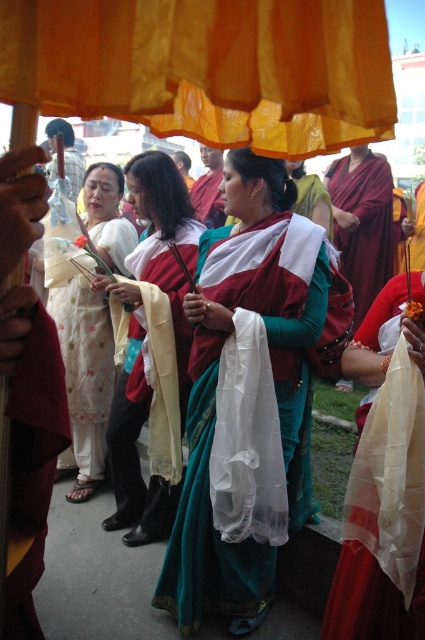
Based on the photo, you are organizing a photo shoot and need to ensure that the green silk saree at center and the matte white scarf at center are both visible in the frame. Based on their sizes, which item should you focus on to ensure both are captured without cropping?

The green silk saree at center is larger in size than the matte white scarf at center. To ensure both are visible without cropping, focus on framing the larger item, the green silk saree at center, as it requires more space, and the smaller matte white scarf at center will naturally fit within the same frame.

You are a photographer at the event and want to capture both the green silk saree at center and the matte white scarf at center in a single frame. What is the minimum distance you need to move your camera backward to ensure both items are fully visible?

The green silk saree at center and the matte white scarf at center are 30.24 inches apart from each other. To capture both in a single frame, the photographer should move the camera backward by at least 30.24 inches to ensure both items are fully visible.

In the scene shown: You are standing in the scene and want to take a photo of both point (172,573) and point (133,161). Which point should you focus on first to ensure both are in focus?

You should focus on point (133,161) first because it is farther from the camera than point (172,573), so adjusting focus starting from the farther point will help ensure both are in focus.